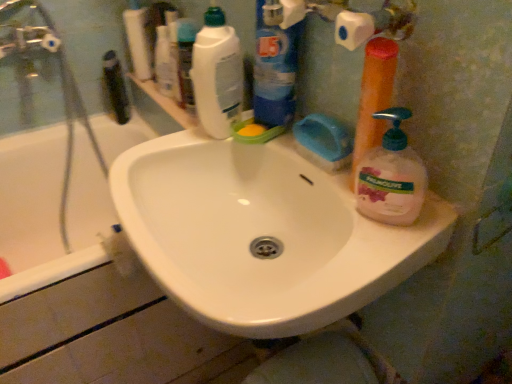
Question: In the image, is pink translucent liquid soap at right, which ranks as the 1th cleaning product in right-to-left order, on the left side or the right side of white glossy sink at center?

Choices:
 (A) left
 (B) right

Answer: (B)

Question: Does point (423, 187) appear closer or farther from the camera than point (362, 276)?

Choices:
 (A) farther
 (B) closer

Answer: (A)

Question: Based on their relative distances, which object is farther from the white glossy bottle at upper center, the 1th toiletry when ordered from right to left?

Choices:
 (A) white glossy bottle at upper center, which is the 1th cleaning product from left to right
 (B) white glossy sink at center
 (C) pink translucent liquid soap at right, arranged as the fourth cleaning product when viewed from the left
 (D) blue plastic bottle at upper center, the 2th cleaning product when ordered from left to right
 (E) orange plastic pump bottle at right, which is the second cleaning product in right-to-left order

Answer: (C)

Question: Estimate the real-world distances between objects in this image. Which object is closer to the black plastic toothbrush at left, placed as the 2th toiletry when sorted from right to left?

Choices:
 (A) orange plastic pump bottle at right, the third cleaning product viewed from the left
 (B) white glossy sink at center
 (C) white glossy bottle at upper center, positioned as the 4th cleaning product in right-to-left order
 (D) blue plastic bottle at upper center, the third cleaning product in the right-to-left sequence
 (E) pink translucent liquid soap at right, which ranks as the 1th cleaning product in right-to-left order

Answer: (C)